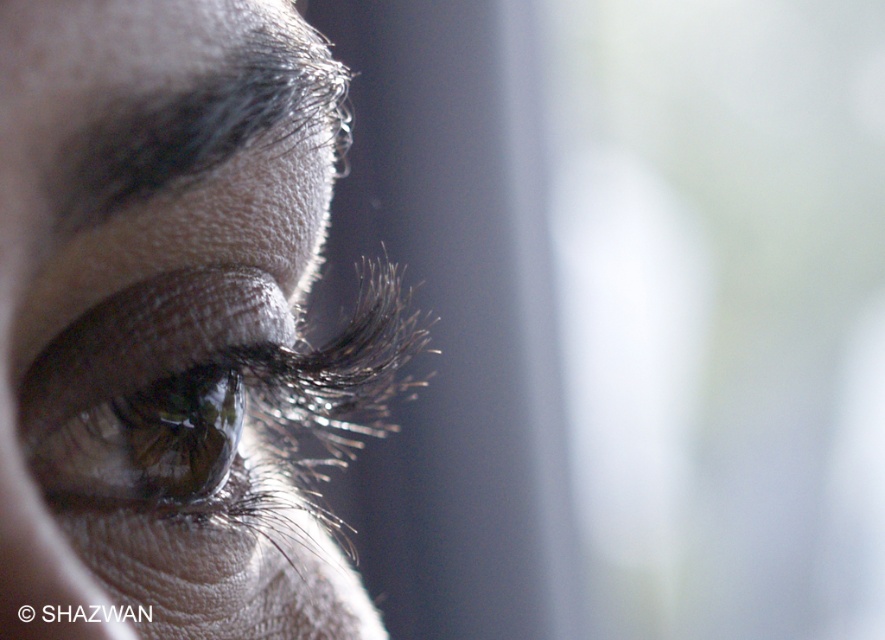
Where is the dark matte eyebrow at upper left located in the image?

The dark matte eyebrow at upper left is located at point (204, 118) in the image.

Based on the photo, you are a makeup artist analyzing an eye closeup image. The image shows a point marked at coordinates (x=175, y=324). According to the image, where is this point located?

The point marked at coordinates (x=175, y=324) is located at the matte skin eye at center.

You are a makeup artist preparing to apply eyeliner to the matte skin eye at center. You notice the dark matte eyebrow at upper left. Considering their positions, which object is closer to you?

The matte skin eye at center is closer to you because it is in front of the dark matte eyebrow at upper left.